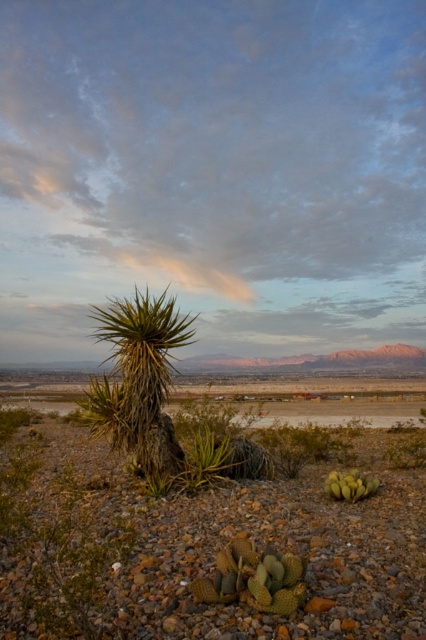
Question: Observing the image, what is the correct spatial positioning of green spiky cactus at lower center in reference to green spiky cactus at lower right?

Choices:
 (A) left
 (B) right

Answer: (A)

Question: Estimate the real-world distances between objects in this image. Which object is farther from the green spiky cactus at lower right?

Choices:
 (A) green spiky plant at center
 (B) green spiky cactus at lower center

Answer: (B)

Question: Which object is closer to the camera taking this photo?

Choices:
 (A) green spiky cactus at center
 (B) green spiky plant at center
 (C) green spiky cactus at lower right
 (D) green spiky cactus at lower center

Answer: (D)

Question: Does green spiky cactus at center have a larger size compared to green spiky cactus at lower right?

Choices:
 (A) yes
 (B) no

Answer: (A)

Question: Can you confirm if green spiky cactus at center is positioned to the right of green spiky plant at center?

Choices:
 (A) yes
 (B) no

Answer: (B)

Question: Which of these objects is positioned farthest from the green spiky cactus at lower right?

Choices:
 (A) green spiky cactus at lower center
 (B) green spiky cactus at center
 (C) green spiky plant at center

Answer: (A)